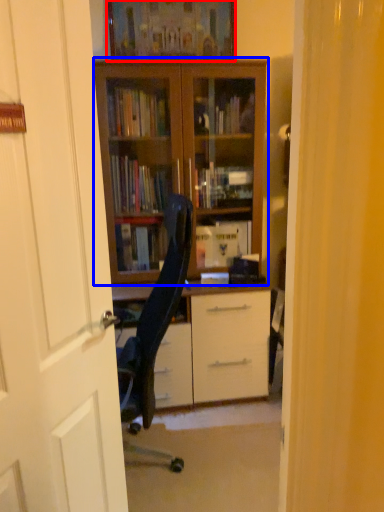
Question: Which object is closer to the camera taking this photo, picture frame (highlighted by a red box) or bookcase (highlighted by a blue box)?

Choices:
 (A) picture frame
 (B) bookcase

Answer: (B)